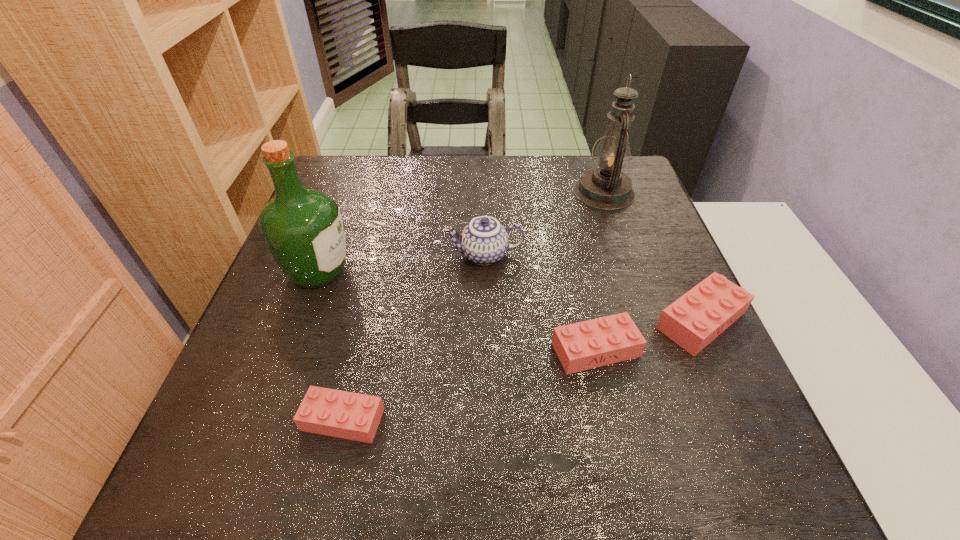
Where is `vacant position in the image that satisfies the following two spatial constraints: 1. on the front-facing side of the liquor; 2. on the right side of the rightmost Lego`? The width and height of the screenshot is (960, 540). vacant position in the image that satisfies the following two spatial constraints: 1. on the front-facing side of the liquor; 2. on the right side of the rightmost Lego is located at coordinates coord(300,321).

You are a GUI agent. You are given a task and a screenshot of the screen. Output one action in this format:
    pyautogui.click(x=<x>, y=<y>)
    Task: Click on the vacant point that satisfies the following two spatial constraints: 1. from the spout of the third object from left to right; 2. on the back side of the rightmost Lego
    
    Given the screenshot: What is the action you would take?
    pyautogui.click(x=486, y=321)

Where is `vacant point that satisfies the following two spatial constraints: 1. on the back side of the second Lego from left to right; 2. on the right side of the farthest object`? vacant point that satisfies the following two spatial constraints: 1. on the back side of the second Lego from left to right; 2. on the right side of the farthest object is located at coordinates (560, 192).